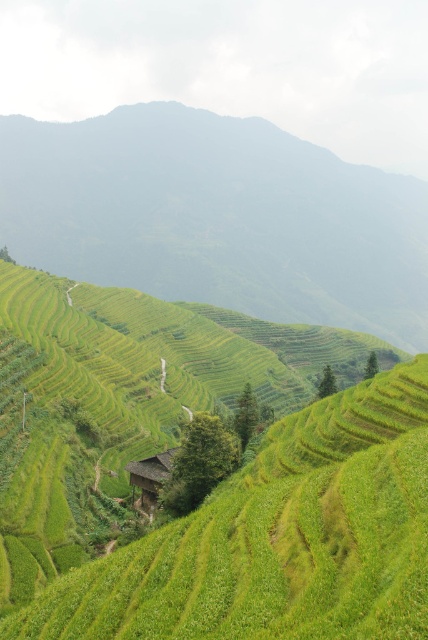
Does green grassy hillside at center appear over brown wooden hut at center?

Yes.

Does point (152, 260) lie behind point (166, 476)?

Yes.

Is point (24, 218) less distant than point (139, 483)?

No, it is not.

The image size is (428, 640). I want to click on green grassy hillside at center, so click(217, 218).